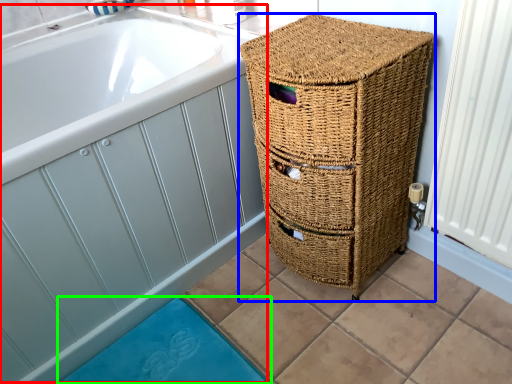
Question: Estimate the real-world distances between objects in this image. Which object is farther from bath (highlighted by a red box), furniture (highlighted by a blue box) or bath mat (highlighted by a green box)?

Choices:
 (A) furniture
 (B) bath mat

Answer: (B)